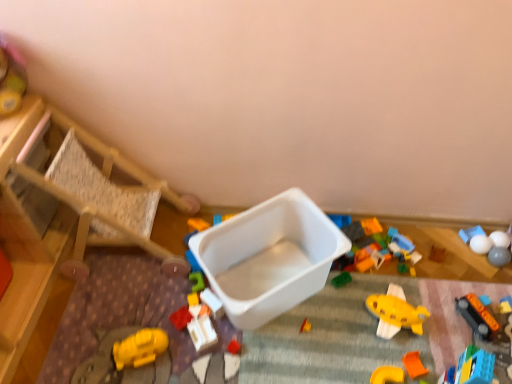
Locate an element on the screen. free space behind orange matte block at lower right, arranged as the eighth toy when viewed from the left is located at coordinates (401, 327).